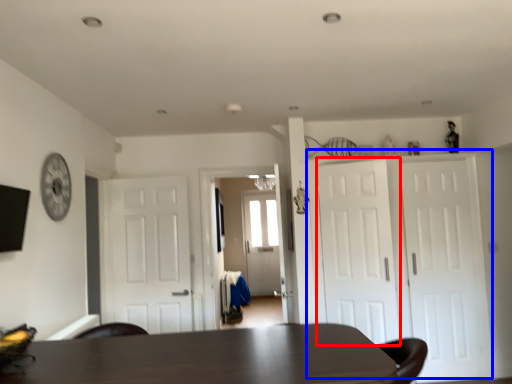
Question: Which object is further to the camera taking this photo, door (highlighted by a red box) or door (highlighted by a blue box)?

Choices:
 (A) door
 (B) door

Answer: (B)